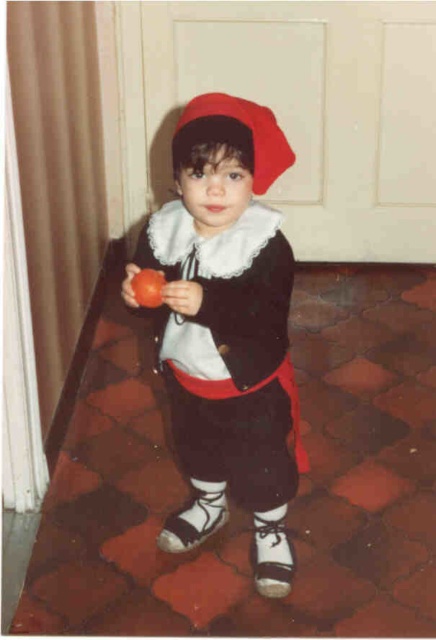
Question: Is smooth red tomato at center closer to the viewer compared to matte orange apple at center?

Choices:
 (A) yes
 (B) no

Answer: (A)

Question: Among these objects, which one is nearest to the camera?

Choices:
 (A) smooth red tomato at center
 (B) red felt hat at center

Answer: (B)

Question: Observing the image, what is the correct spatial positioning of matte red apple at center in reference to smooth red tomato at center?

Choices:
 (A) above
 (B) below

Answer: (B)

Question: Among these objects, which one is farthest from the camera?

Choices:
 (A) red felt hat at center
 (B) matte red apple at center

Answer: (A)

Question: Is smooth red tomato at center further to the viewer compared to matte orange apple at center?

Choices:
 (A) no
 (B) yes

Answer: (A)

Question: Which point is closer to the camera?

Choices:
 (A) (181, 291)
 (B) (130, 280)
 (C) (278, 173)
 (D) (220, 454)

Answer: (A)